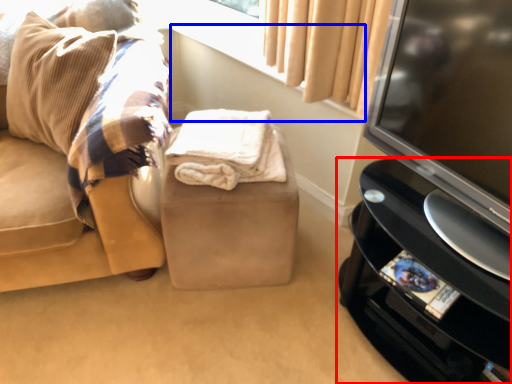
Question: Among these objects, which one is farthest to the camera, furniture (highlighted by a red box) or window sill (highlighted by a blue box)?

Choices:
 (A) furniture
 (B) window sill

Answer: (B)